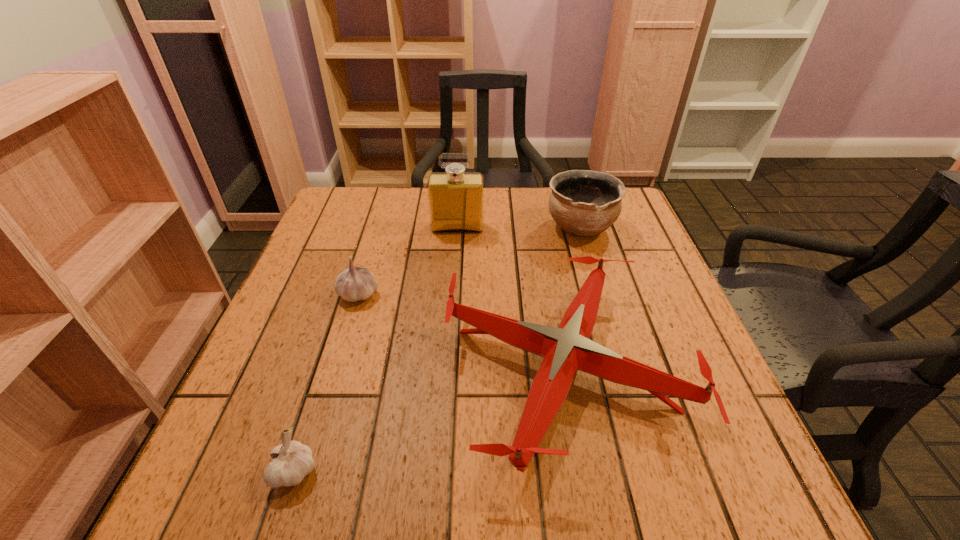
The width and height of the screenshot is (960, 540). I want to click on perfume, so click(x=456, y=198).

At what (x,y) coordinates should I click in order to perform the action: click on pottery. Please return your answer as a coordinate pair (x, y). Looking at the image, I should click on (582, 202).

Identify the location of the farther garlic. The height and width of the screenshot is (540, 960). (353, 284).

The height and width of the screenshot is (540, 960). What are the coordinates of `drone` in the screenshot? It's located at (565, 350).

Identify the location of the shorter garlic. The height and width of the screenshot is (540, 960). (291, 461).

Locate an element on the screen. Image resolution: width=960 pixels, height=540 pixels. vacant space located 0.090m on the front-facing side of the perfume is located at coordinates (456, 256).

Where is `vacant area located 0.320m on the front of the fourth shortest object`? vacant area located 0.320m on the front of the fourth shortest object is located at coordinates (616, 347).

What are the coordinates of `free space located 0.370m on the back of the taller garlic` in the screenshot? It's located at click(x=388, y=197).

This screenshot has height=540, width=960. Identify the location of vacant region located 0.280m on the back of the drone. (537, 220).

Image resolution: width=960 pixels, height=540 pixels. Find the location of `vacant space situated 0.360m on the right of the shorter garlic`. vacant space situated 0.360m on the right of the shorter garlic is located at coordinates (553, 471).